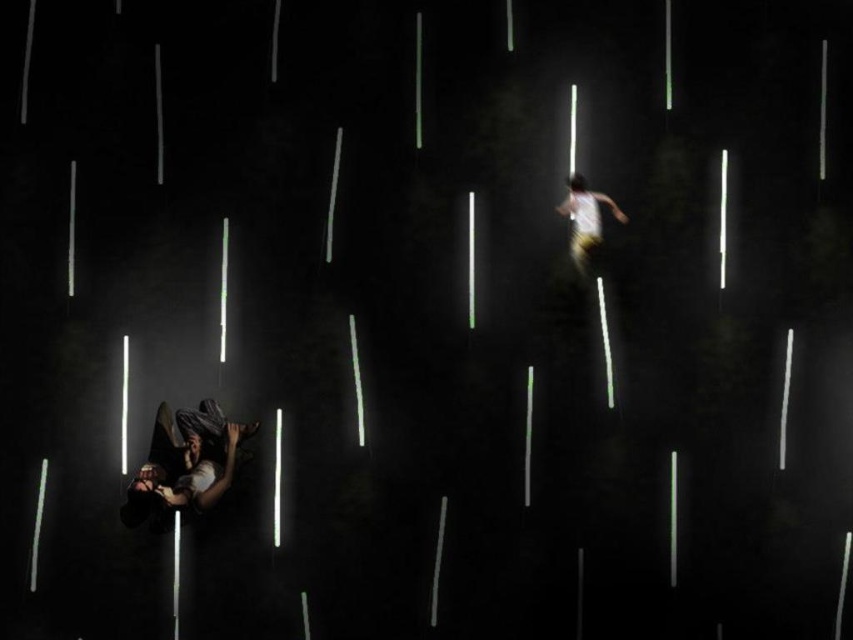
In the scene described, there is a dark gray fabric at lower left represented by point (x=184, y=464). Can you determine if this point is closer to the edge of the image or the center?

The dark gray fabric at lower left is represented by point (x=184, y=464). Since the coordinates are given as normalized values between 0 and 1, the point is closer to the lower left edge of the image compared to the center.

You are a photographer trying to capture the scene. You want to ensure that both the dark gray fabric at lower left and the white cotton shirt at upper right are visible in your photo. Given the lighting conditions, which object might be harder to see and why?

The dark gray fabric at lower left might be harder to see because it is positioned below the white cotton shirt at upper right and the scene has dark background with bright vertical light streaks. The dark fabric would blend into the dark background, making it less visible compared to the lighter shirt against the bright lights.

You are a photographer analyzing the image. You notice the dark gray fabric at lower left and the white cotton shirt at upper right. Which object occupies a larger area in the image?

The dark gray fabric at lower left is bigger than the white cotton shirt at upper right, so it occupies a larger area in the image.